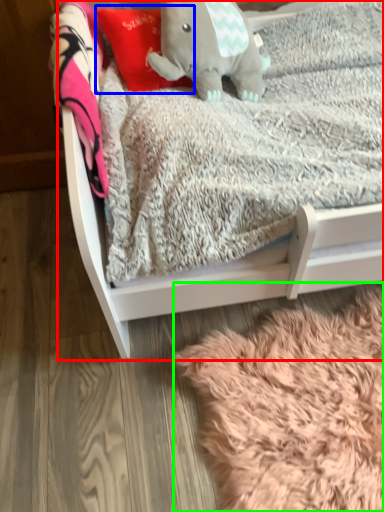
Question: Which object is the farthest from infant bed (highlighted by a red box)? Choose among these: throw pillow (highlighted by a blue box) or blanket (highlighted by a green box).

Choices:
 (A) throw pillow
 (B) blanket

Answer: (A)